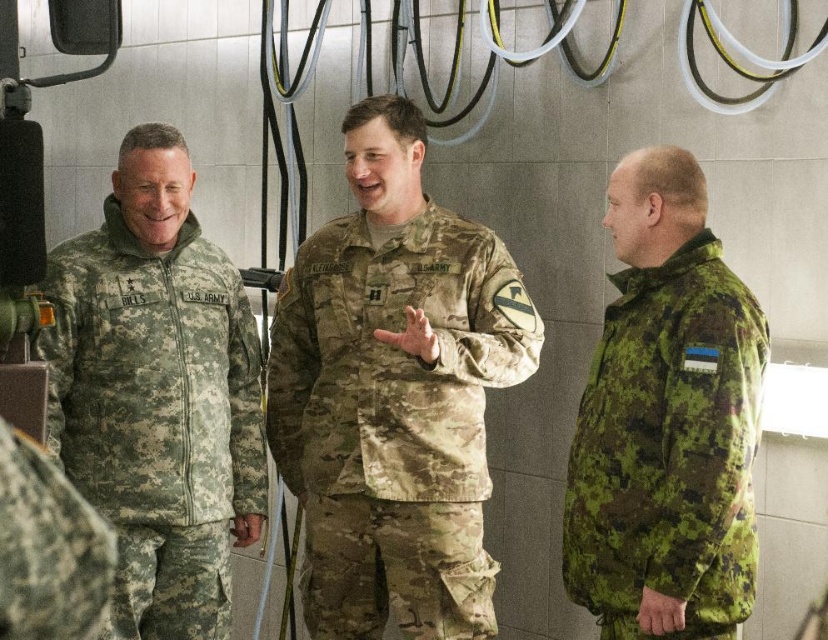
Consider the image. Can you confirm if camouflage fabric uniform at center is positioned to the right of camouflage fabric jacket at right?

In fact, camouflage fabric uniform at center is to the left of camouflage fabric jacket at right.

Identify the location of camouflage fabric uniform at center. This screenshot has height=640, width=828. (395, 419).

Consider the image. Which is more to the right, camouflage fabric jacket at left or camouflage fabric uniform at left?

Positioned to the right is camouflage fabric uniform at left.

Who is shorter, camouflage fabric jacket at left or camouflage fabric uniform at left?

camouflage fabric uniform at left is shorter.

Locate an element on the screen. This screenshot has height=640, width=828. camouflage fabric jacket at left is located at coordinates (157, 416).

This screenshot has width=828, height=640. Describe the element at coordinates (668, 449) in the screenshot. I see `camouflage fabric jacket at right` at that location.

Who is positioned more to the left, camouflage fabric jacket at right or camouflage fabric uniform at left?

camouflage fabric uniform at left

The height and width of the screenshot is (640, 828). In order to click on camouflage fabric jacket at right in this screenshot , I will do click(668, 449).